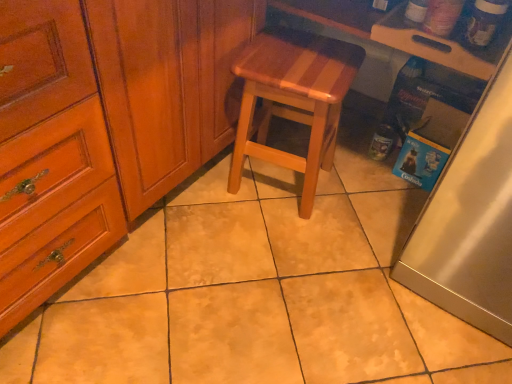
The height and width of the screenshot is (384, 512). Describe the element at coordinates (400, 34) in the screenshot. I see `wooden cutting board at upper right` at that location.

Identify the location of satin silver fridge at right. (470, 221).

Between point (508, 90) and point (454, 67), which one is positioned behind?

The point (454, 67) is farther.

Is satin silver fridge at right far from wooden cutting board at upper right?

satin silver fridge at right is near wooden cutting board at upper right, not far away.

Can wooden cutting board at upper right be found inside satin silver fridge at right?

No, satin silver fridge at right does not contain wooden cutting board at upper right.

Considering the relative sizes of satin silver fridge at right and wooden cutting board at upper right in the image provided, is satin silver fridge at right thinner than wooden cutting board at upper right?

No.

Would you say natural wood stool at center is to the left or to the right of wooden cutting board at upper right in the picture?

Based on their positions, natural wood stool at center is located to the left of wooden cutting board at upper right.

Is natural wood stool at center wider than wooden cutting board at upper right?

No.

Is natural wood stool at center next to wooden cutting board at upper right?

They are not placed beside each other.

Could you tell me if natural wood stool at center is turned towards satin silver fridge at right?

No, natural wood stool at center does not turn towards satin silver fridge at right.

Is natural wood stool at center bigger than satin silver fridge at right?

Incorrect, natural wood stool at center is not larger than satin silver fridge at right.

From the picture: Can you see natural wood stool at center touching satin silver fridge at right?

No, natural wood stool at center is not next to satin silver fridge at right.

How many degrees apart are the facing directions of wooden cutting board at upper right and natural wood stool at center?

169 degrees.

Which is more to the right, wooden cutting board at upper right or natural wood stool at center?

wooden cutting board at upper right is more to the right.

Would you say wooden cutting board at upper right contains natural wood stool at center?

Actually, natural wood stool at center is outside wooden cutting board at upper right.

From the image's perspective, is wooden cutting board at upper right above satin silver fridge at right?

Indeed, from the image's perspective, wooden cutting board at upper right is shown above satin silver fridge at right.

Is satin silver fridge at right at the back of wooden cutting board at upper right?

wooden cutting board at upper right does not have its back to satin silver fridge at right.

Can you confirm if wooden cutting board at upper right is taller than satin silver fridge at right?

No.

How different are the orientations of wooden cutting board at upper right and satin silver fridge at right in degrees?

They differ by 0.335 degrees in their facing directions.

From a real-world perspective, is satin silver fridge at right under natural wood stool at center?

Incorrect, from a real-world perspective, satin silver fridge at right is higher than natural wood stool at center.

From the image's perspective, is satin silver fridge at right over natural wood stool at center?

No.

Is the depth of satin silver fridge at right greater than that of natural wood stool at center?

No, satin silver fridge at right is in front of natural wood stool at center.

Which is in front, point (496, 175) or point (239, 64)?

The point (496, 175) is more forward.

At what (x,y) coordinates should I click in order to perform the action: click on fridge on the right of wooden cutting board at upper right. Please return your answer as a coordinate pair (x, y). Looking at the image, I should click on (470, 221).

This screenshot has width=512, height=384. Find the location of `stool behind the wooden cutting board at upper right`. stool behind the wooden cutting board at upper right is located at coordinates (293, 99).

Estimate the real-world distances between objects in this image. Which object is further from satin silver fridge at right, natural wood stool at center or wooden cutting board at upper right?

Based on the image, natural wood stool at center appears to be further to satin silver fridge at right.

When comparing their distances from wooden cutting board at upper right, does natural wood stool at center or satin silver fridge at right seem further?

satin silver fridge at right lies further to wooden cutting board at upper right than the other object.

Considering their positions, is wooden cutting board at upper right positioned closer to satin silver fridge at right than natural wood stool at center?

wooden cutting board at upper right lies closer to satin silver fridge at right than the other object.

When comparing their distances from natural wood stool at center, does satin silver fridge at right or wooden cutting board at upper right seem closer?

Based on the image, wooden cutting board at upper right appears to be nearer to natural wood stool at center.

Considering their positions, is satin silver fridge at right positioned closer to wooden cutting board at upper right than natural wood stool at center?

natural wood stool at center is positioned closer to the anchor wooden cutting board at upper right.

Considering their positions, is wooden cutting board at upper right positioned closer to natural wood stool at center than satin silver fridge at right?

wooden cutting board at upper right lies closer to natural wood stool at center than the other object.

Identify the location of counter top between natural wood stool at center and satin silver fridge at right in the horizontal direction. The height and width of the screenshot is (384, 512). (400, 34).